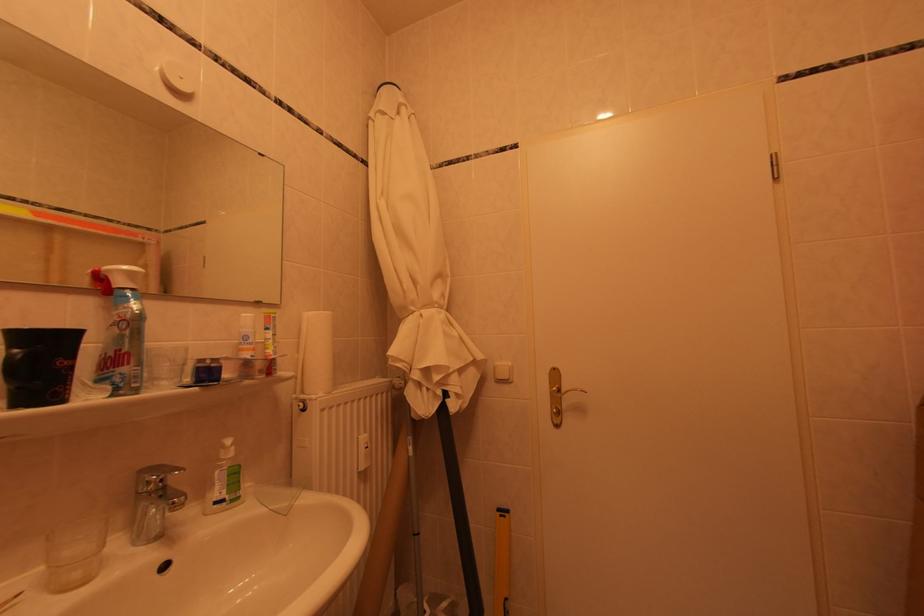
The height and width of the screenshot is (616, 924). I want to click on white light switch, so click(503, 371).